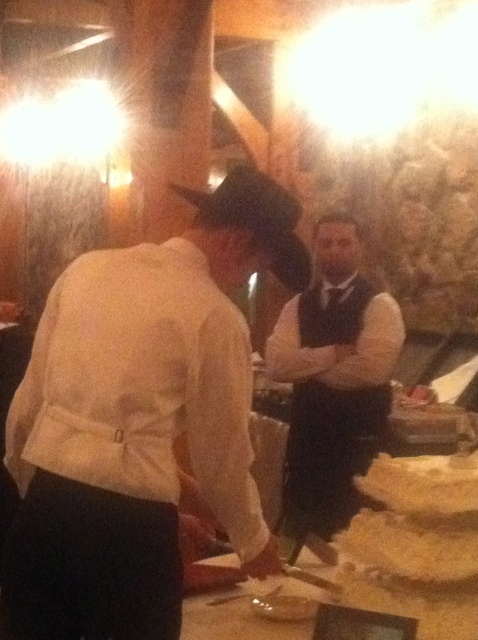
Question: Can you confirm if white matte hat at upper left is wider than golden crumbly pastry at lower right?

Choices:
 (A) yes
 (B) no

Answer: (A)

Question: Can you confirm if white matte hat at upper left is positioned to the right of golden crispy bread at lower right?

Choices:
 (A) yes
 (B) no

Answer: (B)

Question: Does white matte hat at upper left come behind golden crumbly pastry at lower center?

Choices:
 (A) yes
 (B) no

Answer: (B)

Question: Based on their relative distances, which object is nearer to the dark brown leather vest at center?

Choices:
 (A) white matte hat at upper left
 (B) golden crispy bread at lower right
 (C) golden crumbly pastry at lower center

Answer: (B)

Question: Which object is closer to the camera taking this photo?

Choices:
 (A) white matte hat at upper left
 (B) golden crispy bread at lower right

Answer: (A)

Question: Which point is closer to the camera?

Choices:
 (A) golden crumbly pastry at lower right
 (B) golden crumbly pastry at lower center
 (C) dark brown leather vest at center
 (D) golden crispy bread at lower right

Answer: (A)